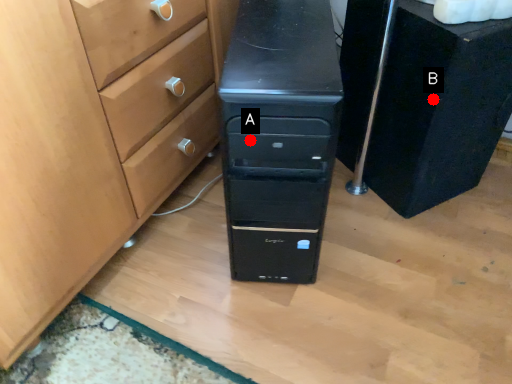
Question: Two points are circled on the image, labeled by A and B beside each circle. Which point is farther from the camera taking this photo?

Choices:
 (A) A is further
 (B) B is further

Answer: (B)